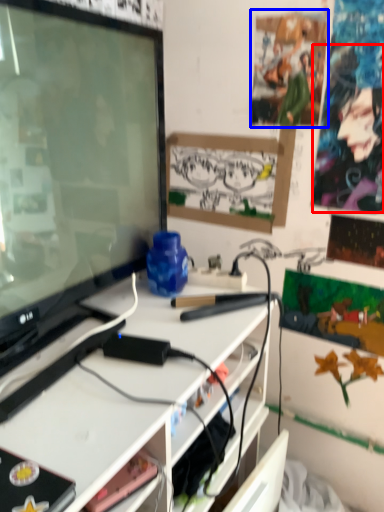
Question: Which of the following is the closest to the observer, person (highlighted by a red box) or poster (highlighted by a blue box)?

Choices:
 (A) person
 (B) poster

Answer: (A)